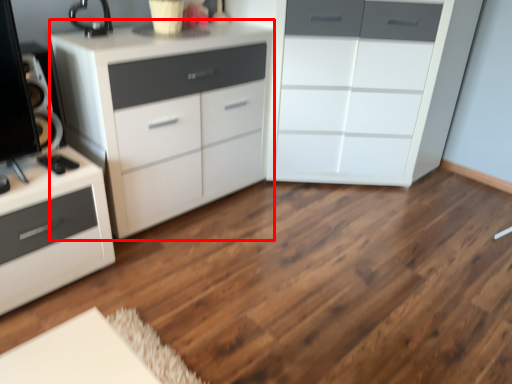
Question: Considering the relative positions of chest of drawers (annotated by the red box) and chest of drawers in the image provided, where is chest of drawers (annotated by the red box) located with respect to the staircase?

Choices:
 (A) right
 (B) left

Answer: (B)